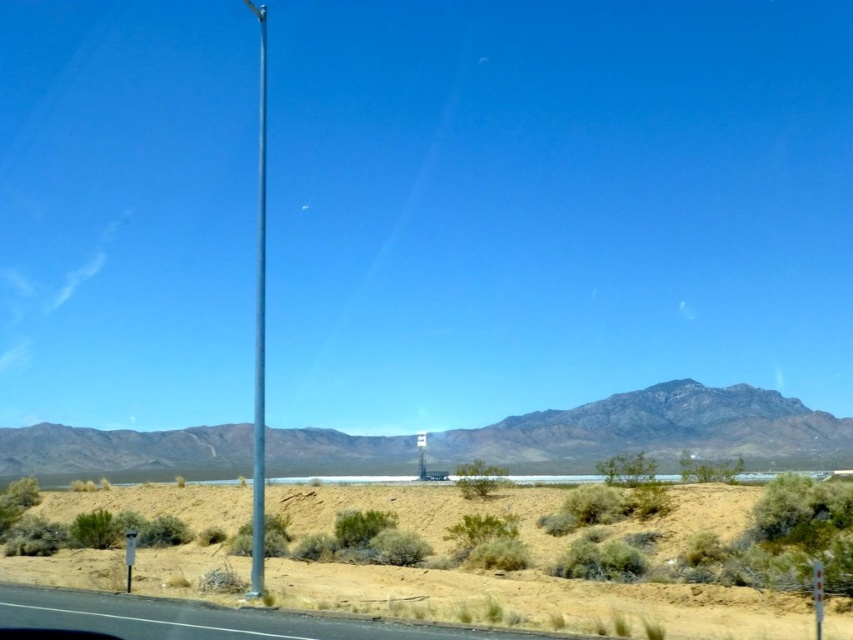
Question: Considering the relative positions of clear glass pole at center and metallic rectangular sign at right in the image provided, where is clear glass pole at center located with respect to metallic rectangular sign at right?

Choices:
 (A) right
 (B) left

Answer: (B)

Question: Which object is farther from the camera taking this photo?

Choices:
 (A) dried grass at lower center
 (B) metallic pole at left
 (C) rocky brown mountain at center

Answer: (C)

Question: Does dried grass at lower center appear over black asphalt highway at lower left?

Choices:
 (A) no
 (B) yes

Answer: (A)

Question: Can you confirm if black asphalt highway at lower left is positioned above metallic rectangular sign at right?

Choices:
 (A) no
 (B) yes

Answer: (B)

Question: Based on their relative distances, which object is nearer to the dried grass at lower center?

Choices:
 (A) black asphalt highway at lower left
 (B) metallic rectangular sign at right

Answer: (A)

Question: Among these points, which one is farthest from the camera?

Choices:
 (A) (672, 448)
 (B) (289, 636)
 (C) (259, 33)
 (D) (817, 618)

Answer: (C)